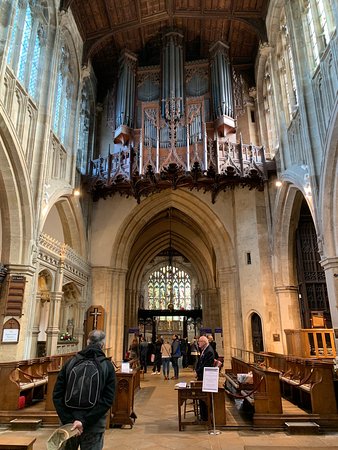
Locate an element on the screen. This screenshot has width=338, height=450. pew is located at coordinates click(x=36, y=374), click(x=235, y=375), click(x=288, y=377).